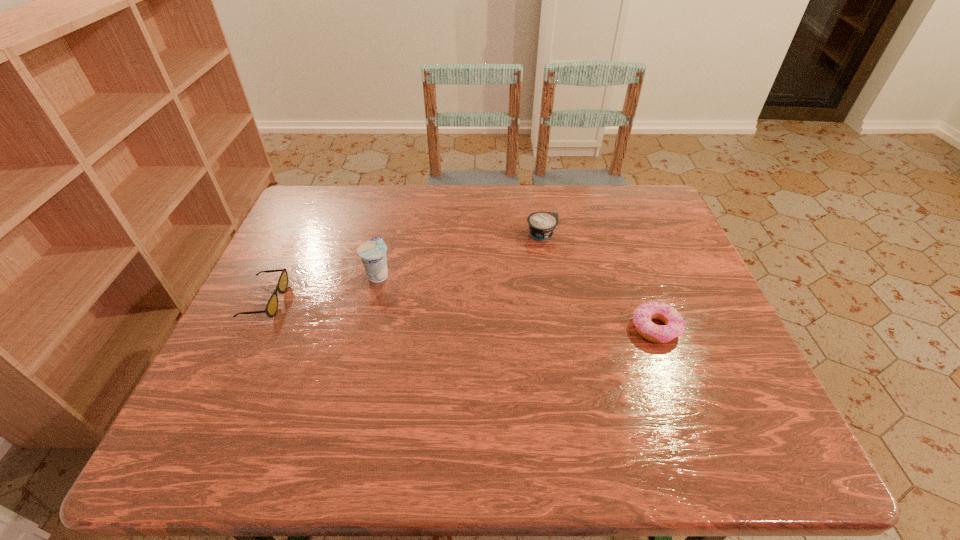
This screenshot has height=540, width=960. What are the coordinates of `object that is the second nearest to the tallest object` in the screenshot? It's located at (542, 224).

Where is `object that stands as the closest to the doughnut`? object that stands as the closest to the doughnut is located at coordinates (542, 224).

I want to click on vacant space that satisfies the following two spatial constraints: 1. on the front side of the second object from left to right; 2. on the front-facing side of the leftmost object, so click(x=372, y=301).

Identify the location of vacant space that satisfies the following two spatial constraints: 1. on the front side of the second object from left to right; 2. on the left side of the rightmost object. (366, 328).

The image size is (960, 540). In order to click on blank space that satisfies the following two spatial constraints: 1. on the front-facing side of the sunglasses; 2. on the back side of the doughnut in this screenshot , I will do `click(252, 328)`.

At what (x,y) coordinates should I click in order to perform the action: click on free region that satisfies the following two spatial constraints: 1. on the front-facing side of the leftmost object; 2. on the right side of the rightmost object. Please return your answer as a coordinate pair (x, y). Looking at the image, I should click on (252, 328).

Locate an element on the screen. The image size is (960, 540). vacant space that satisfies the following two spatial constraints: 1. on the front side of the shortest object; 2. on the left side of the farther yogurt is located at coordinates (557, 328).

The width and height of the screenshot is (960, 540). Find the location of `blank space that satisfies the following two spatial constraints: 1. on the front-facing side of the sunglasses; 2. on the right side of the rightmost object`. blank space that satisfies the following two spatial constraints: 1. on the front-facing side of the sunglasses; 2. on the right side of the rightmost object is located at coordinates (252, 328).

What are the coordinates of `vacant space that satisfies the following two spatial constraints: 1. on the front side of the tallest object; 2. on the left side of the doughnut` in the screenshot? It's located at (366, 328).